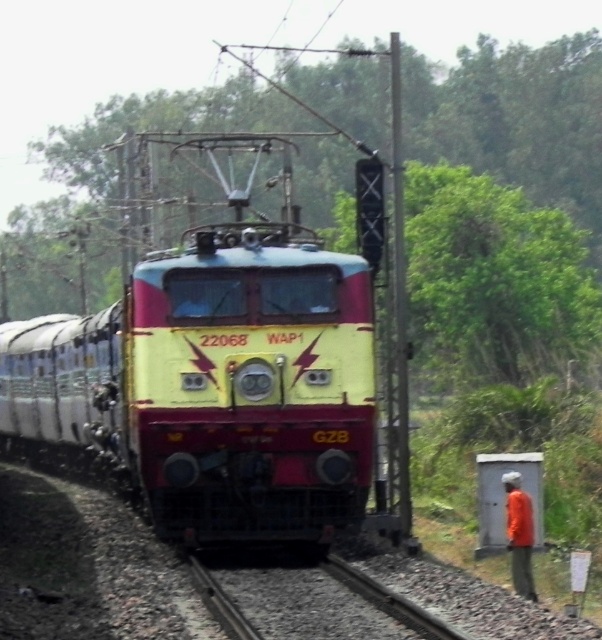
Which is more to the left, yellow matte train at center or green leafy tree at upper center?

yellow matte train at center

Looking at this image, does yellow matte train at center have a greater width compared to green leafy tree at upper center?

No.

What do you see at coordinates (216, 380) in the screenshot?
I see `yellow matte train at center` at bounding box center [216, 380].

Find the location of a particular element. yellow matte train at center is located at coordinates pyautogui.click(x=216, y=380).

Does black gravel train track at center have a lesser height compared to orange fabric shirt at lower right?

Yes, black gravel train track at center is shorter than orange fabric shirt at lower right.

This screenshot has width=602, height=640. What do you see at coordinates (388, 600) in the screenshot?
I see `black gravel train track at center` at bounding box center [388, 600].

Where is `black gravel train track at center`? Image resolution: width=602 pixels, height=640 pixels. black gravel train track at center is located at coordinates (388, 600).

Is green leafy tree at upper center positioned before black gravel train track at center?

No, green leafy tree at upper center is behind black gravel train track at center.

Between point (54, 294) and point (200, 595), which one is positioned behind?

The point (54, 294) is behind.

This screenshot has height=640, width=602. What are the coordinates of `green leafy tree at upper center` in the screenshot? It's located at (517, 120).

At what (x,y) coordinates should I click in order to perform the action: click on green leafy tree at upper center. Please return your answer as a coordinate pair (x, y). The image size is (602, 640). Looking at the image, I should click on (517, 120).